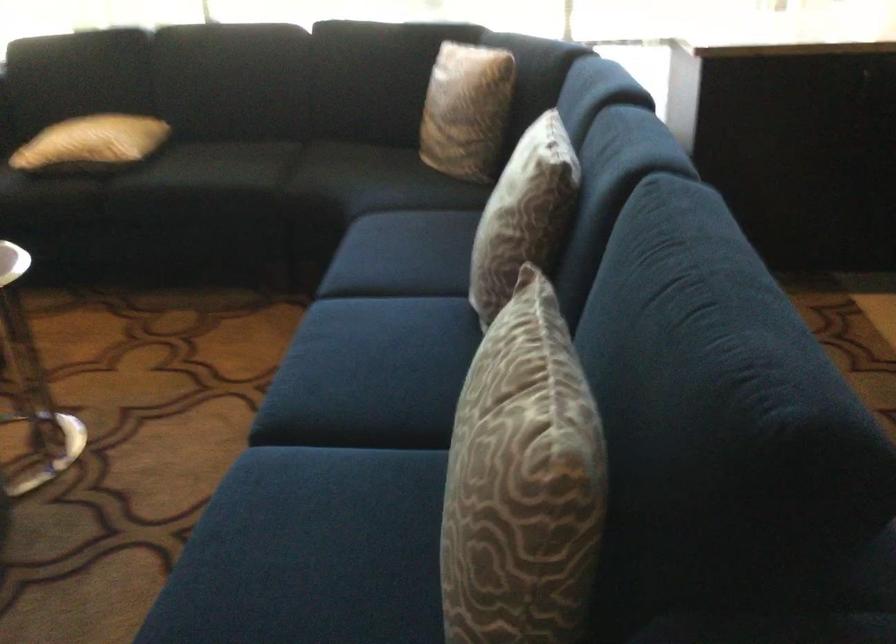
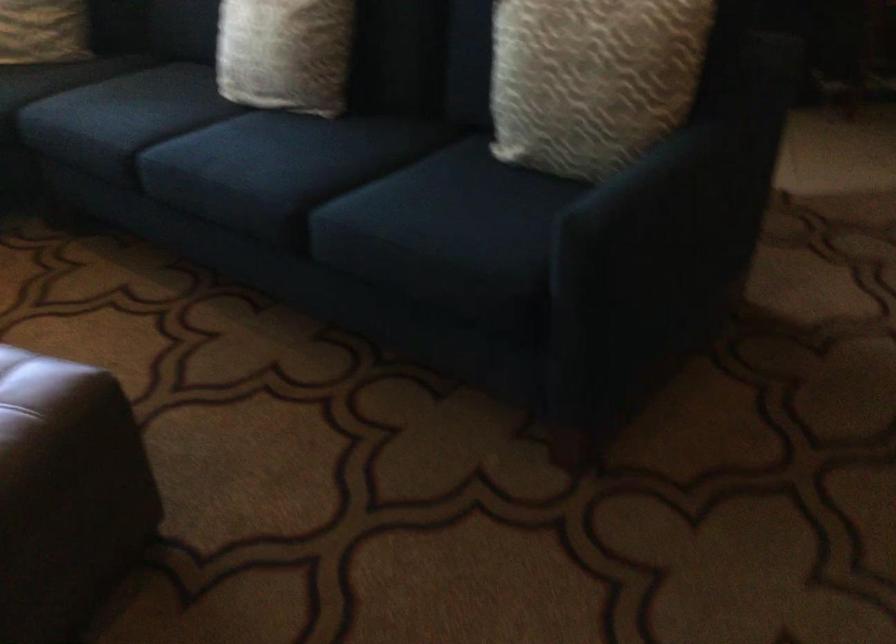
The point at (x=478, y=259) is marked in the first image. Where is the corresponding point in the second image?

(285, 53)